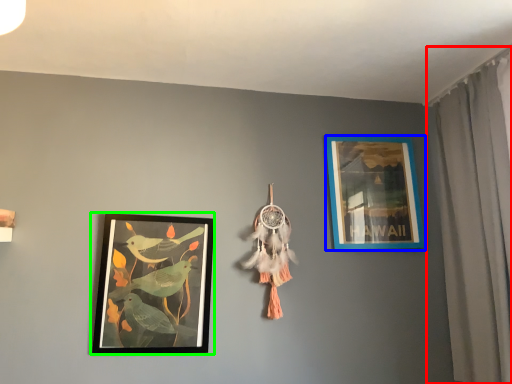
Question: Which object is positioned closest to curtain (highlighted by a red box)? Select from picture frame (highlighted by a blue box) and picture frame (highlighted by a green box).

Choices:
 (A) picture frame
 (B) picture frame

Answer: (A)